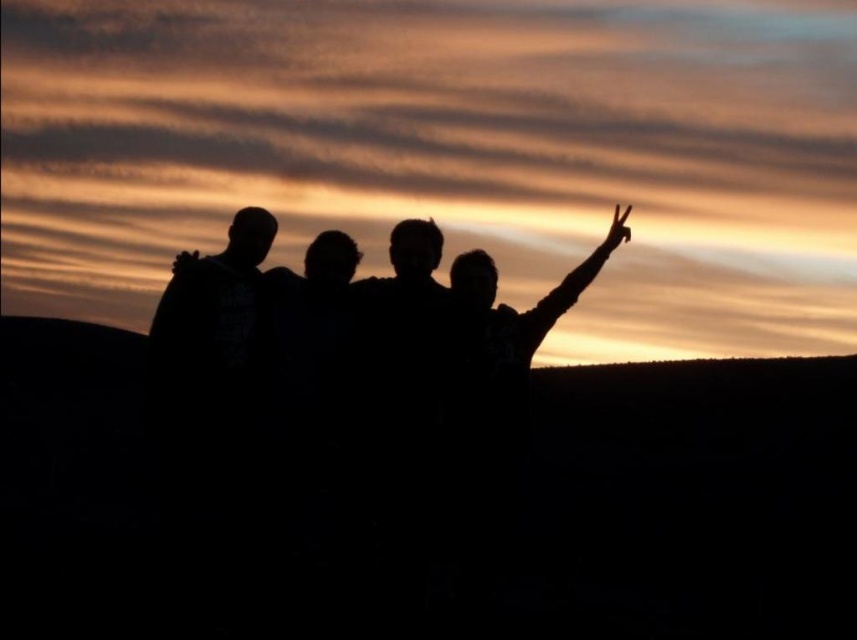
Between black matte arm at upper left and matte black hand at upper right, which one is positioned higher?

Positioned higher is matte black hand at upper right.

Can you confirm if black matte arm at upper left is wider than matte black hand at upper right?

Correct, the width of black matte arm at upper left exceeds that of matte black hand at upper right.

This screenshot has width=857, height=640. I want to click on black matte arm at upper left, so click(x=175, y=298).

Who is more forward, (547, 627) or (192, 253)?

Point (547, 627) is in front.

The width and height of the screenshot is (857, 640). Find the location of `black matte hillside at lower left`. black matte hillside at lower left is located at coordinates (688, 502).

In the scene shown: Is black matte hillside at lower left bigger than black matte arm at upper right?

Indeed, black matte hillside at lower left has a larger size compared to black matte arm at upper right.

Does point (580, 410) come farther from viewer compared to point (553, 312)?

Yes, it is behind point (553, 312).

The image size is (857, 640). Find the location of `black matte hillside at lower left`. black matte hillside at lower left is located at coordinates (688, 502).